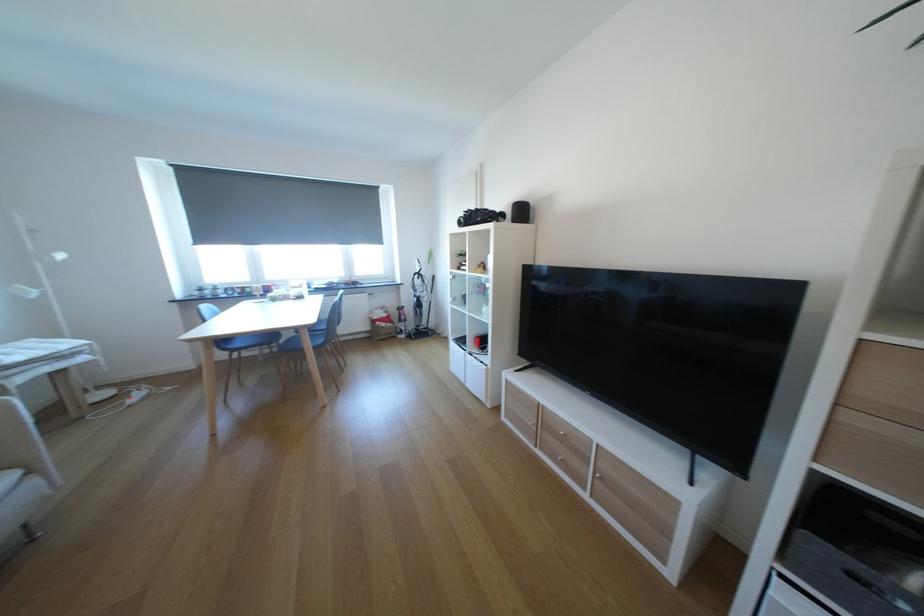
This screenshot has height=616, width=924. Identify the location of sofa armrest. (22, 471).